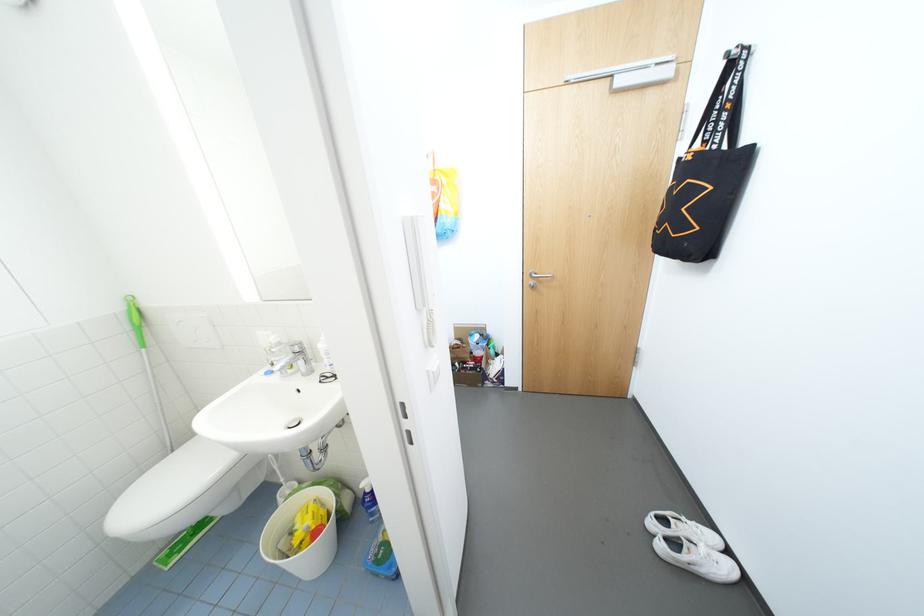
Find the location of a particular element. faucet lever handle is located at coordinates (298, 353).